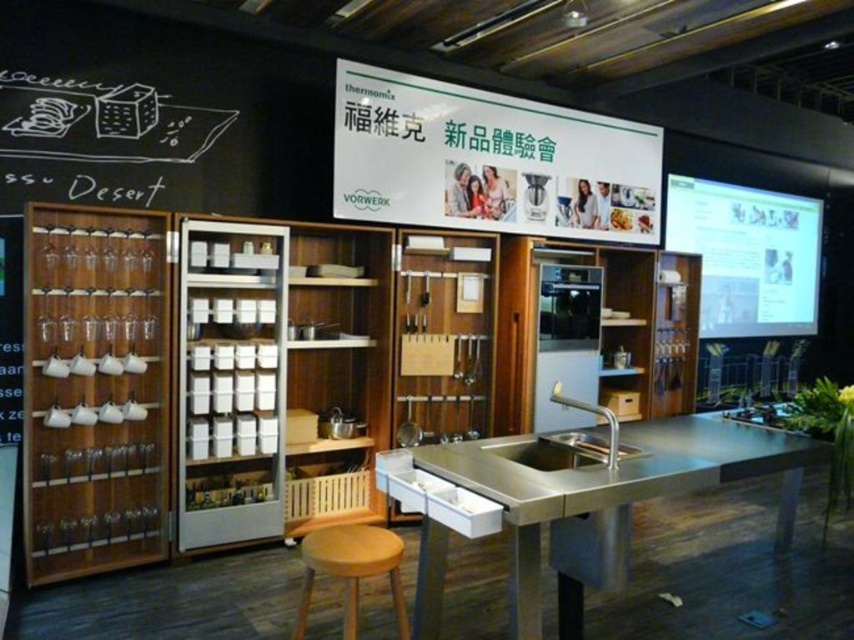
You are a guest at the Vorwerk product launch event and want to know if the stainless steel sink at center can be seen above the white paper at upper center. Based on the scene description, can you determine this?

The stainless steel sink at center is taller than white paper at upper center, so yes, the sink can be seen above the white paper at upper center.

You are organizing a product launch event and need to place a rectangular banner that is 1.2 meters wide. You have two options for placement on the kitchen display setup. The first option is above the white paper at upper center, and the second option is above the satin nickel sink at center. Based on the spatial details provided, which location would allow the banner to fit without exceeding the width of the object below it?

The white paper at upper center might be wider than the satin nickel sink at center, so placing the banner above the white paper at upper center has a higher chance of fitting the 1.2 meter wide banner without exceeding its width.

You are a guest at the Vorwerk product launch event and want to wash your hands. The stainless steel sink at center and the light brown wooden stool at center are in your way. Which object should you move first to access the sink?

The light brown wooden stool at center is behind the stainless steel sink at center, so you should move the light brown wooden stool at center first to access the sink.